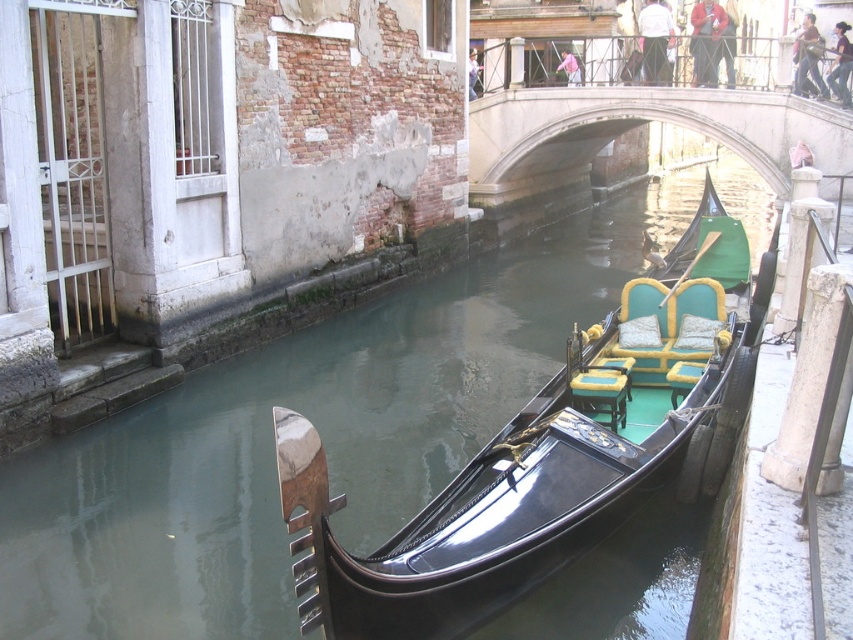
Question: Does concrete stone bridge at center appear on the left side of teal fabric cushion at center?

Choices:
 (A) yes
 (B) no

Answer: (B)

Question: Which object is closer to the camera taking this photo?

Choices:
 (A) concrete stone bridge at center
 (B) teal fabric cushion at center

Answer: (B)

Question: Estimate the real-world distances between objects in this image. Which object is farther from the concrete stone bridge at center?

Choices:
 (A) teal fabric cushion at center
 (B) shiny black gondola at center

Answer: (A)

Question: Does shiny black gondola at center have a smaller size compared to concrete stone bridge at center?

Choices:
 (A) no
 (B) yes

Answer: (A)

Question: Is shiny black gondola at center positioned behind teal fabric cushion at center?

Choices:
 (A) yes
 (B) no

Answer: (B)

Question: Which object is the closest to the teal fabric cushion at center?

Choices:
 (A) shiny black gondola at center
 (B) concrete stone bridge at center

Answer: (A)